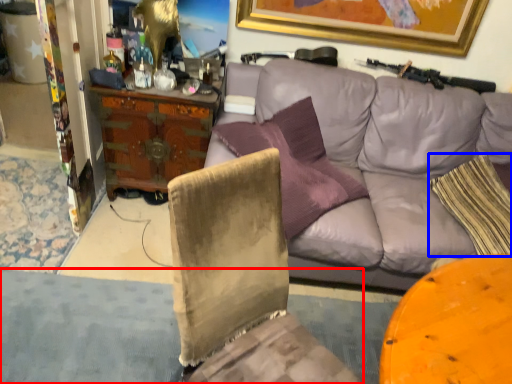
Question: Which object is closer to the camera taking this photo, gray (highlighted by a red box) or pillow (highlighted by a blue box)?

Choices:
 (A) gray
 (B) pillow

Answer: (A)